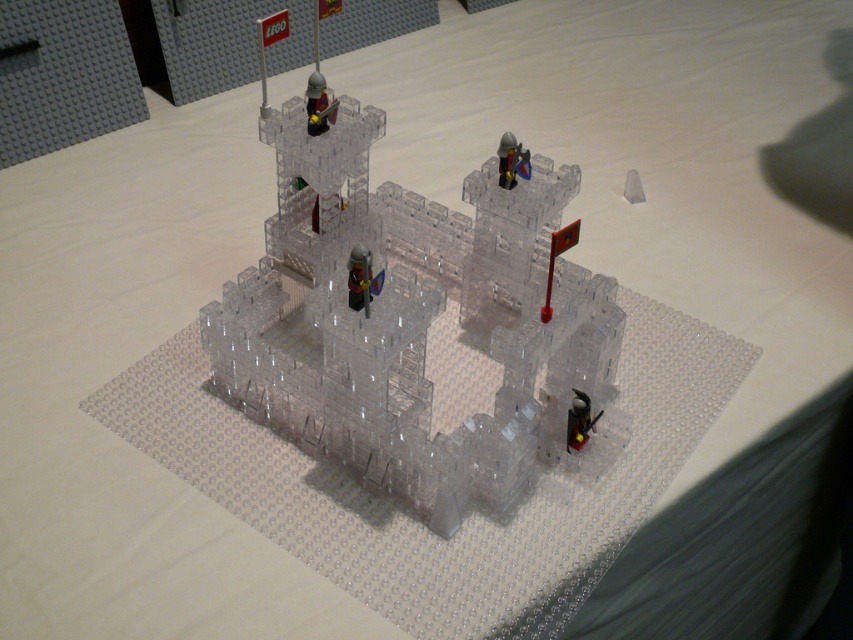
You are a visitor at a LEGO exhibition and notice the transparent plastic figure at center. According to the exhibition guidelines, you must determine if the figure is positioned within the designated central area, which is defined as the square region from coordinates 0.4 to 0.4 up to 0.5 to 0.5. Is the figure within this area?

The transparent plastic figure at center is located at point (361,278), which falls within the designated central area defined by the square region from 0.4 to 0.4 up to 0.5 to 0.5. Therefore, the figure is within the required area.

Please provide the 2D coordinates of the transparent plastic castle at center in the image. The coordinates should be in the format of a point with two decimal values separated by a comma. Your answer should only contain the coordinates without any additional text.

(410,321)